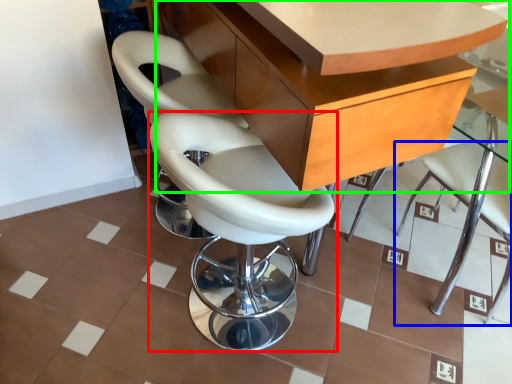
Question: Which object is positioned farthest from chair (highlighted by a red box)? Select from chair (highlighted by a blue box) and table (highlighted by a green box).

Choices:
 (A) chair
 (B) table

Answer: (A)